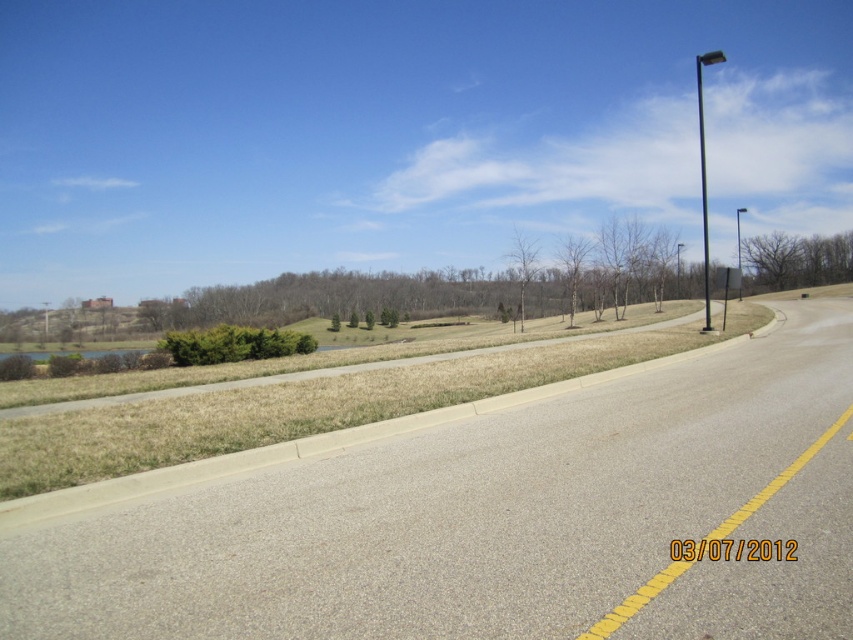
You are a driver approaching the gray asphalt highway at center and the bare branches at center. Which object will appear closer to you as you drive forward?

The gray asphalt highway at center will appear closer than the bare branches at center because it is smaller in size, indicating it is nearer to the observer.

Consider the image. You are driving a car that is 5 meters long. You need to make a U turn in the area between the brown textured tree at upper right and the black metal pole at upper right. Can your car fit in that space?

The brown textured tree at upper right and the black metal pole at upper right are 11.22 meters apart. Since your car is 5 meters long, it can fit comfortably within the 11.22 meter space between them for the U turn.

You are a hiker planning to take a photo of the brown textured tree at upper right and the black metal pole at upper right from the middle of the road. Which object will appear smaller in your photo?

The brown textured tree at upper right will appear smaller in the photo because it occupies less space than the black metal pole at upper right.